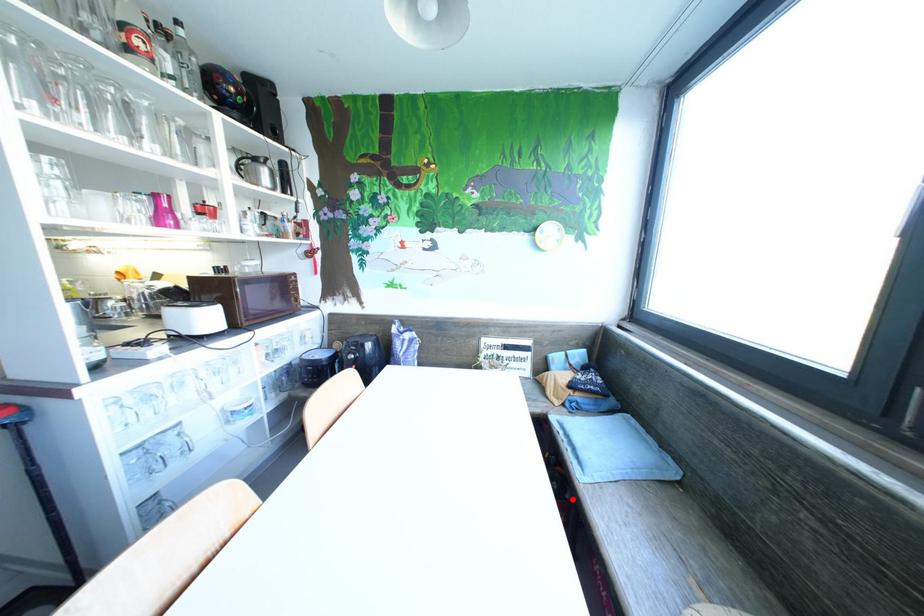
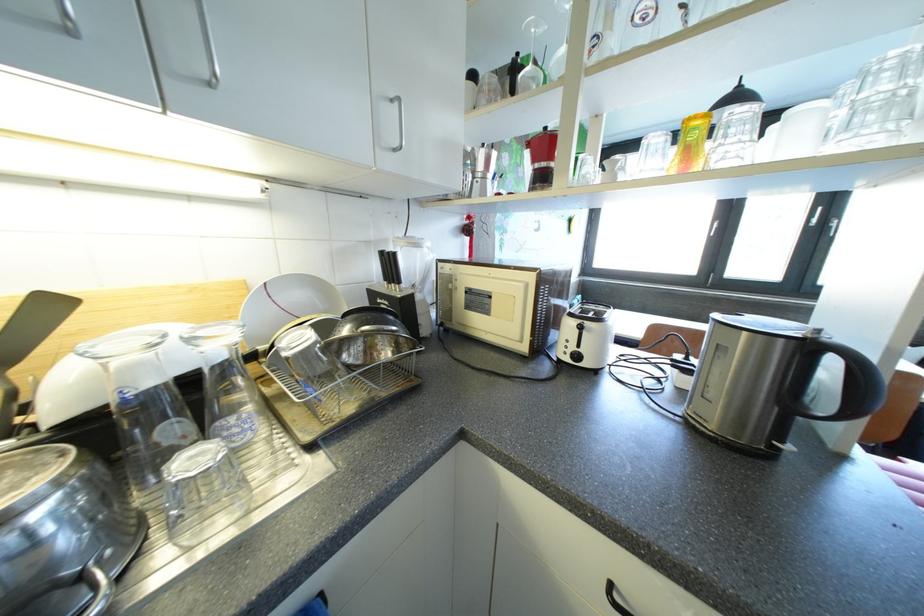
Question: I am providing you with two images of the same scene from different viewpoints. A red point is marked on the first image. At the location where the point appears in image 1, is it still visible in image 2?

Choices:
 (A) Yes
 (B) No

Answer: (B)